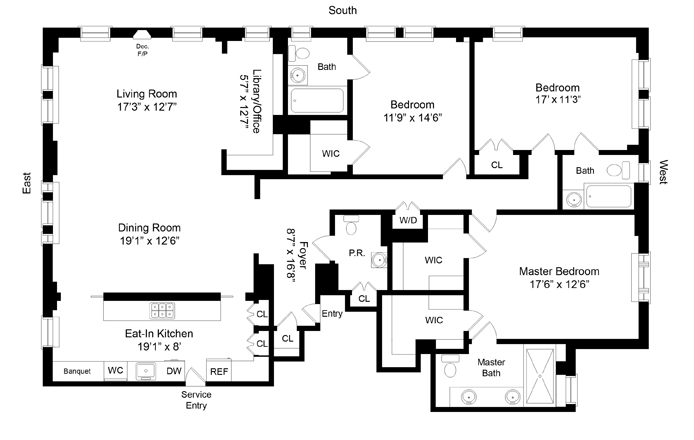
The height and width of the screenshot is (440, 694). I want to click on master bathwc, so click(513, 383), click(439, 319).